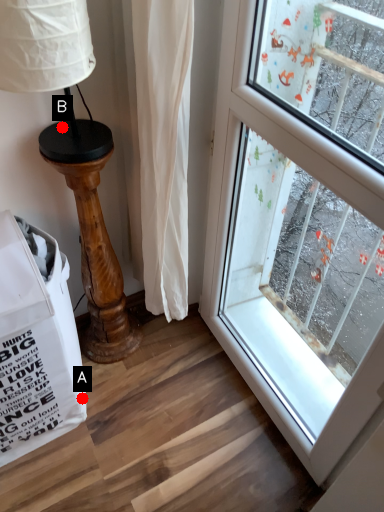
Question: Two points are circled on the image, labeled by A and B beside each circle. Which point appears farthest from the camera in this image?

Choices:
 (A) A is further
 (B) B is further

Answer: (A)